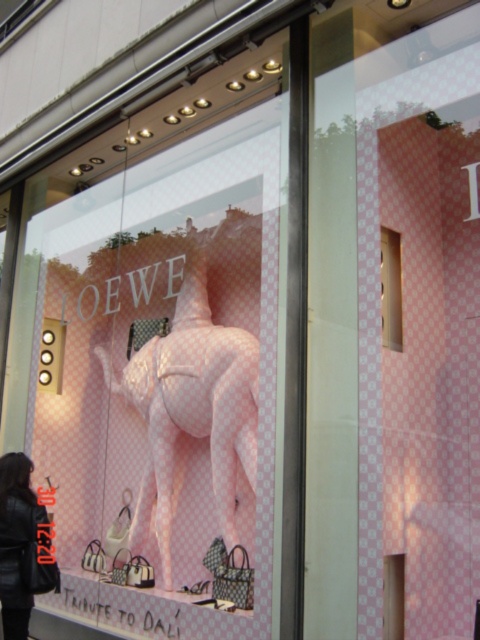
You are standing in front of the LOEWE storefront window. There is a point marked at coordinates (192, 410). What object is located at that point?

The pink checkered mannequin at center is located at point (192, 410).

You are standing in front of the LOEWE storefront window display. You notice two points marked on the window at coordinates point (176,330) and point (386,308). Which point is closer to you?

Point (176,330) is further to the camera than point (386,308), so the point closer to you is point (386,308).

Consider the image. You are a store employee who needs to place a new item in the window display. The new item is 30 cm wide. There is a black leather jacket at lower left and a pink glossy box at upper right. Which object can the new item fit next to without exceeding its width?

The new item can fit next to the pink glossy box at upper right since the black leather jacket at lower left is wider than the pink glossy box at upper right according to the description.